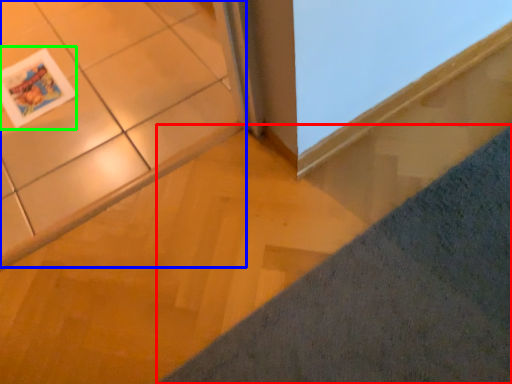
Question: Which object is positioned closest to concrete (highlighted by a red box)? Select from ceramic tile (highlighted by a blue box) and magazine (highlighted by a green box).

Choices:
 (A) ceramic tile
 (B) magazine

Answer: (A)